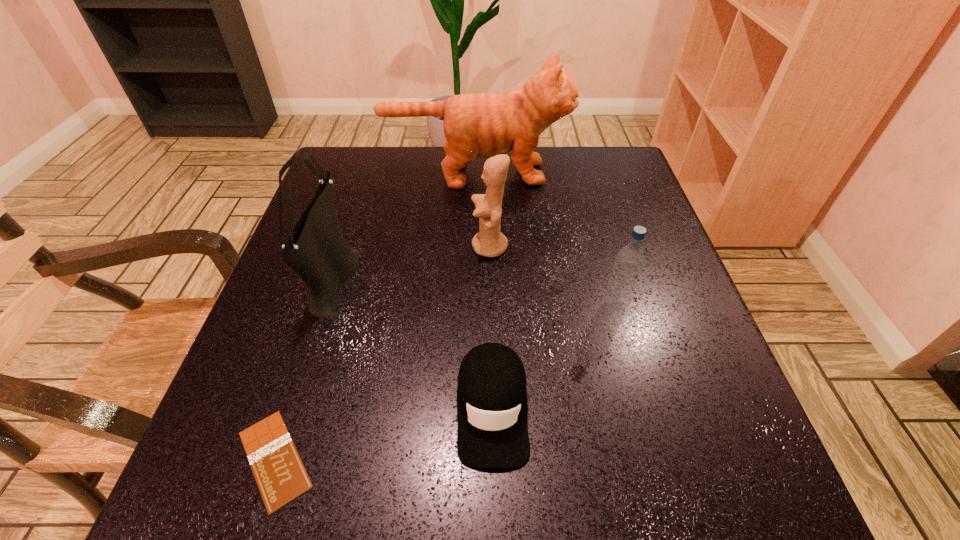
Find the location of a particular element. The width and height of the screenshot is (960, 540). vacant region between the farthest object and the water bottle is located at coordinates (545, 239).

The height and width of the screenshot is (540, 960). Find the location of `empty location between the rightmost object and the cat`. empty location between the rightmost object and the cat is located at coordinates (545, 239).

Where is `vacant space that is in between the chocolate bar and the shoulder bag`? The width and height of the screenshot is (960, 540). vacant space that is in between the chocolate bar and the shoulder bag is located at coordinates (304, 368).

Where is `vacant region between the chocolate bar and the cap`? vacant region between the chocolate bar and the cap is located at coordinates (383, 434).

Identify the location of vacant area between the shortest object and the cat. Image resolution: width=960 pixels, height=540 pixels. (375, 316).

I want to click on vacant space that is in between the figurine and the second shortest object, so click(x=491, y=327).

What are the coordinates of `free space between the figurine and the second shortest object` in the screenshot? It's located at (491, 327).

Where is `free space between the second shortest object and the shortest object`? This screenshot has height=540, width=960. free space between the second shortest object and the shortest object is located at coordinates (383, 434).

Find the location of a particular element. unoccupied area between the fourth tallest object and the shoulder bag is located at coordinates (474, 292).

Identify the location of object that stands as the closest to the figurine. Image resolution: width=960 pixels, height=540 pixels. (483, 125).